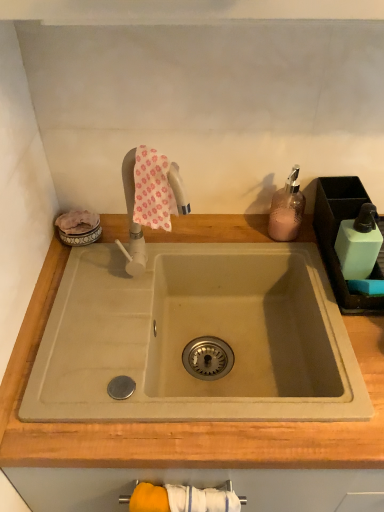
This screenshot has height=512, width=384. What are the coordinates of `vacant space that's between pink textured soap dispenser at upper right and light green plastic soap dispenser at right` in the screenshot? It's located at (312, 251).